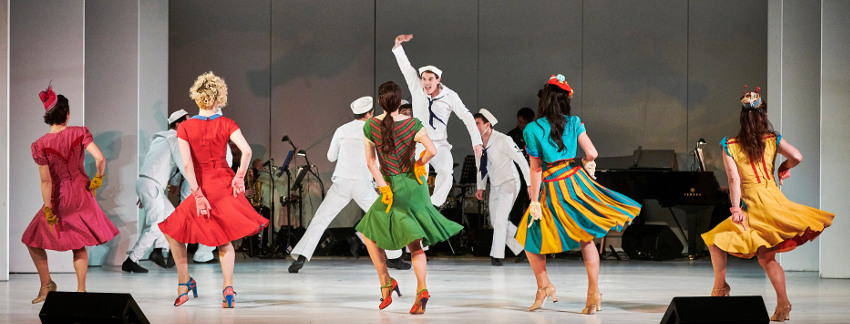
Identify the location of back stage panels. (223, 22), (309, 30), (437, 20), (520, 28), (632, 32), (739, 23).